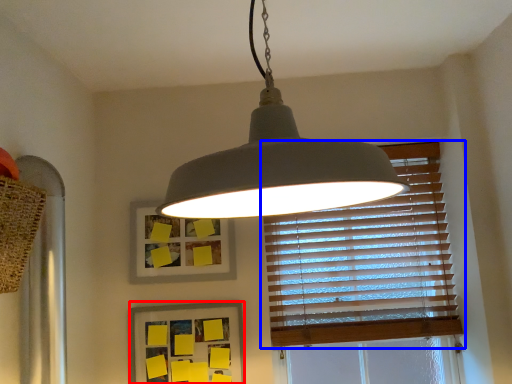
Question: Which of the following is the closest to the observer, picture frame (highlighted by a red box) or window blind (highlighted by a blue box)?

Choices:
 (A) picture frame
 (B) window blind

Answer: (A)